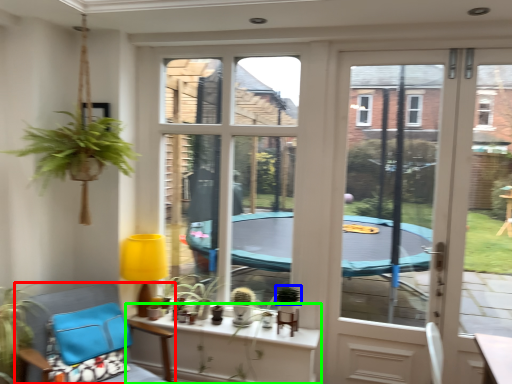
Question: Which is farther away from chair (highlighted by a red box)? plant (highlighted by a blue box) or window (highlighted by a green box)?

Choices:
 (A) plant
 (B) window

Answer: (A)